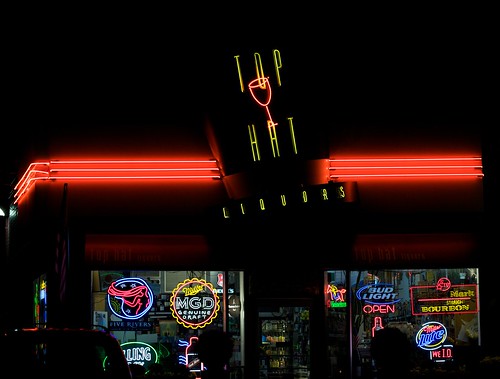
Identify the location of drinking glass light. The image size is (500, 379). 265,104.